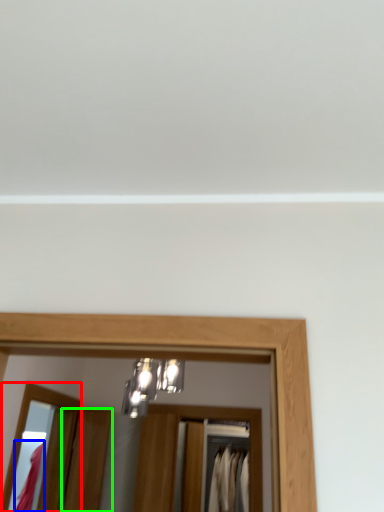
Question: Based on their relative distances, which object is farther from mirror (highlighted by a red box)? Choose from clothing (highlighted by a blue box) and door (highlighted by a green box).

Choices:
 (A) clothing
 (B) door

Answer: (A)